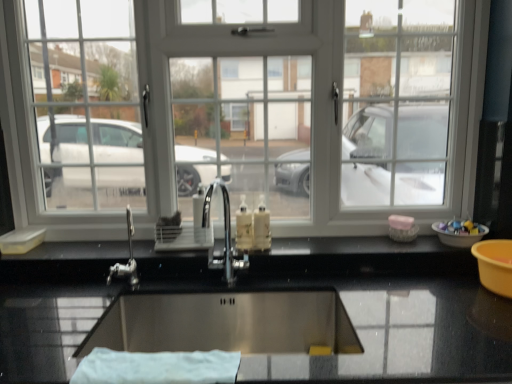
Question: From the image's perspective, is white plastic window at center on polished chrome tap at center?

Choices:
 (A) no
 (B) yes

Answer: (B)

Question: From the image's perspective, is white plastic window at center below polished chrome tap at center?

Choices:
 (A) no
 (B) yes

Answer: (A)

Question: From a real-world perspective, is white plastic window at center located higher than polished chrome tap at center?

Choices:
 (A) yes
 (B) no

Answer: (A)

Question: Considering the relative sizes of white plastic window at center and polished chrome tap at center in the image provided, is white plastic window at center thinner than polished chrome tap at center?

Choices:
 (A) no
 (B) yes

Answer: (B)

Question: Is white plastic window at center aimed at polished chrome tap at center?

Choices:
 (A) yes
 (B) no

Answer: (A)

Question: Is the surface of white plastic window at center in direct contact with polished chrome tap at center?

Choices:
 (A) no
 (B) yes

Answer: (A)

Question: Is the depth of translucent plastic soap dispenser at center less than that of white plastic window at center?

Choices:
 (A) no
 (B) yes

Answer: (B)

Question: Is there a large distance between translucent plastic soap dispenser at center and white plastic window at center?

Choices:
 (A) yes
 (B) no

Answer: (B)

Question: Can you confirm if translucent plastic soap dispenser at center is smaller than white plastic window at center?

Choices:
 (A) no
 (B) yes

Answer: (B)

Question: From a real-world perspective, does translucent plastic soap dispenser at center stand above white plastic window at center?

Choices:
 (A) yes
 (B) no

Answer: (B)

Question: Is translucent plastic soap dispenser at center beside white plastic window at center?

Choices:
 (A) no
 (B) yes

Answer: (A)

Question: Does translucent plastic soap dispenser at center have a greater height compared to white plastic window at center?

Choices:
 (A) no
 (B) yes

Answer: (A)

Question: From the image's perspective, does white cloth at lower center appear higher than white plastic bowl at right?

Choices:
 (A) no
 (B) yes

Answer: (A)